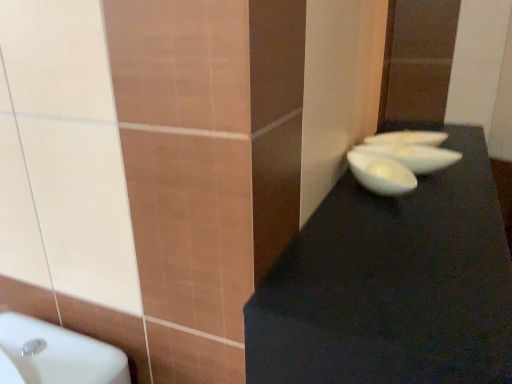
This screenshot has width=512, height=384. I want to click on white glossy bowl at center, the 2th basin in the back-to-front sequence, so click(x=413, y=156).

The height and width of the screenshot is (384, 512). Describe the element at coordinates (392, 284) in the screenshot. I see `black matte table at right` at that location.

Image resolution: width=512 pixels, height=384 pixels. Identify the location of white glossy bowl at upper right, positioned as the first basin in back-to-front order. (408, 138).

At what (x,y) coordinates should I click in order to perform the action: click on white glossy bowl at center, the first basin viewed from the front. Please return your answer as a coordinate pair (x, y). This screenshot has width=512, height=384. Looking at the image, I should click on (413, 156).

Is white glossy bowl at center, the first basin viewed from the front, directly adjacent to black matte table at right?

No, white glossy bowl at center, the first basin viewed from the front, is not making contact with black matte table at right.

From a real-world perspective, is white glossy bowl at center, the first basin viewed from the front, above or below black matte table at right?

white glossy bowl at center, the first basin viewed from the front, is above black matte table at right.

Considering the relative positions of white glossy bowl at center, the 2th basin in the back-to-front sequence, and black matte table at right in the image provided, is white glossy bowl at center, the 2th basin in the back-to-front sequence, to the left or to the right of black matte table at right?

From the image, it's evident that white glossy bowl at center, the 2th basin in the back-to-front sequence, is to the left of black matte table at right.

How distant is white glossy bowl at center, the first basin viewed from the front, from black matte table at right?

A distance of 13.53 inches exists between white glossy bowl at center, the first basin viewed from the front, and black matte table at right.

From a real-world perspective, is black matte table at right physically below white glossy bowl at center, the first basin viewed from the front?

Correct, in the physical world, black matte table at right is lower than white glossy bowl at center, the first basin viewed from the front.

From the picture: Does black matte table at right come behind white glossy bowl at center, the first basin viewed from the front?

No.

Is black matte table at right shorter than white glossy bowl at center, the first basin viewed from the front?

No.

Considering the sizes of objects white glossy bowl at center right and white glossy bowl at upper right, positioned as the first basin in back-to-front order, in the image provided, who is thinner, white glossy bowl at center right or white glossy bowl at upper right, positioned as the first basin in back-to-front order,?

Thinner between the two is white glossy bowl at center right.

From a real-world perspective, relative to white glossy bowl at upper right, positioned as the first basin in back-to-front order, is white glossy bowl at center right vertically above or below?

In terms of real-world spatial position, white glossy bowl at center right is below white glossy bowl at upper right, positioned as the first basin in back-to-front order.

Is point (391, 167) closer or farther from the camera than point (419, 131)?

Point (391, 167) is closer to the camera than point (419, 131).

Is white glossy bowl at center right far from white glossy bowl at upper right, positioned as the first basin in back-to-front order?

white glossy bowl at center right is actually quite close to white glossy bowl at upper right, positioned as the first basin in back-to-front order.

Measure the distance from black matte table at right to white glossy bowl at center right.

black matte table at right is 24.92 centimeters away from white glossy bowl at center right.

Is black matte table at right not within white glossy bowl at center right?

Yes.

Does point (449, 343) lie behind point (371, 189)?

No.

From the image's perspective, which is below, black matte table at right or white glossy bowl at center right?

black matte table at right, from the image's perspective.

Image resolution: width=512 pixels, height=384 pixels. In order to click on table top on the left side of white glossy bowl at upper right, the second basin in the front-to-back sequence in this screenshot , I will do `click(392, 284)`.

From the image's perspective, between white glossy bowl at upper right, positioned as the first basin in back-to-front order, and black matte table at right, who is located below?

black matte table at right appears lower in the image.

Which object is thinner, white glossy bowl at upper right, the second basin in the front-to-back sequence, or black matte table at right?

With smaller width is white glossy bowl at upper right, the second basin in the front-to-back sequence.

Considering the sizes of objects white glossy bowl at upper right, the second basin in the front-to-back sequence, and black matte table at right in the image provided, who is smaller, white glossy bowl at upper right, the second basin in the front-to-back sequence, or black matte table at right?

Smaller between the two is white glossy bowl at upper right, the second basin in the front-to-back sequence.

Which of these two, white glossy bowl at upper right, positioned as the first basin in back-to-front order, or white glossy bowl at center right, is wider?

With larger width is white glossy bowl at upper right, positioned as the first basin in back-to-front order.

Is white glossy bowl at upper right, the second basin in the front-to-back sequence, taller than white glossy bowl at center right?

No, white glossy bowl at upper right, the second basin in the front-to-back sequence, is not taller than white glossy bowl at center right.

Does white glossy bowl at upper right, positioned as the first basin in back-to-front order, appear on the right side of white glossy bowl at center right?

Yes, white glossy bowl at upper right, positioned as the first basin in back-to-front order, is to the right of white glossy bowl at center right.

In the scene shown: Are white glossy bowl at upper right, the second basin in the front-to-back sequence, and white glossy bowl at center right beside each other?

No.

Considering the positions of objects white glossy bowl at center, the first basin viewed from the front, and white glossy bowl at center right in the image provided, who is behind, white glossy bowl at center, the first basin viewed from the front, or white glossy bowl at center right?

white glossy bowl at center, the first basin viewed from the front, is further from the camera.

Is white glossy bowl at center, the 2th basin in the back-to-front sequence, surrounding white glossy bowl at center right?

That's incorrect, white glossy bowl at center right is not inside white glossy bowl at center, the 2th basin in the back-to-front sequence.

How different are the orientations of white glossy bowl at center, the 2th basin in the back-to-front sequence, and white glossy bowl at center right in degrees?

54.1 degrees separate the facing orientations of white glossy bowl at center, the 2th basin in the back-to-front sequence, and white glossy bowl at center right.

Considering the positions of point (459, 157) and point (371, 180), is point (459, 157) closer or farther from the camera than point (371, 180)?

Clearly, point (459, 157) is more distant from the camera than point (371, 180).

The image size is (512, 384). Find the location of `table top located underneath the white glossy bowl at center, the first basin viewed from the front (from a real-world perspective)`. table top located underneath the white glossy bowl at center, the first basin viewed from the front (from a real-world perspective) is located at coordinates (392, 284).

Identify the location of table top on the right of white glossy bowl at center, the 2th basin in the back-to-front sequence. (392, 284).

Estimate the real-world distances between objects in this image. Which object is further from white glossy bowl at center right, white glossy bowl at center, the 2th basin in the back-to-front sequence, or white glossy bowl at upper right, positioned as the first basin in back-to-front order?

white glossy bowl at upper right, positioned as the first basin in back-to-front order, lies further to white glossy bowl at center right than the other object.

From the image, which object appears to be nearer to white glossy bowl at upper right, positioned as the first basin in back-to-front order, black matte table at right or white glossy bowl at center, the 2th basin in the back-to-front sequence?

white glossy bowl at center, the 2th basin in the back-to-front sequence, is positioned closer to the anchor white glossy bowl at upper right, positioned as the first basin in back-to-front order.

When comparing their distances from black matte table at right, does white glossy bowl at center right or white glossy bowl at center, the 2th basin in the back-to-front sequence, seem closer?

white glossy bowl at center right is closer to black matte table at right.

When comparing their distances from white glossy bowl at upper right, the second basin in the front-to-back sequence, does black matte table at right or white glossy bowl at center right seem closer?

Based on the image, white glossy bowl at center right appears to be nearer to white glossy bowl at upper right, the second basin in the front-to-back sequence.

When comparing their distances from white glossy bowl at center right, does white glossy bowl at upper right, the second basin in the front-to-back sequence, or white glossy bowl at center, the 2th basin in the back-to-front sequence, seem further?

Based on the image, white glossy bowl at upper right, the second basin in the front-to-back sequence, appears to be further to white glossy bowl at center right.

Based on their spatial positions, is black matte table at right or white glossy bowl at upper right, positioned as the first basin in back-to-front order, closer to white glossy bowl at center right?

black matte table at right is closer to white glossy bowl at center right.

Considering their positions, is white glossy bowl at center right positioned closer to white glossy bowl at center, the first basin viewed from the front, than white glossy bowl at upper right, the second basin in the front-to-back sequence?

The object closer to white glossy bowl at center, the first basin viewed from the front, is white glossy bowl at upper right, the second basin in the front-to-back sequence.

When comparing their distances from black matte table at right, does white glossy bowl at center, the first basin viewed from the front, or white glossy bowl at upper right, the second basin in the front-to-back sequence, seem closer?

white glossy bowl at center, the first basin viewed from the front.

The image size is (512, 384). I want to click on basin positioned between white glossy bowl at center right and white glossy bowl at upper right, positioned as the first basin in back-to-front order, from near to far, so click(413, 156).

You are a GUI agent. You are given a task and a screenshot of the screen. Output one action in this format:
    pyautogui.click(x=<x>, y=<y>)
    Task: Click on the basin between black matte table at right and white glossy bowl at upper right, positioned as the first basin in back-to-front order, in the front-back direction
    Image resolution: width=512 pixels, height=384 pixels.
    Given the screenshot: What is the action you would take?
    pyautogui.click(x=413, y=156)

Locate an element on the screen. The height and width of the screenshot is (384, 512). glass bowl between black matte table at right and white glossy bowl at center, the 2th basin in the back-to-front sequence, along the z-axis is located at coordinates (381, 174).

The height and width of the screenshot is (384, 512). In order to click on glass bowl positioned between black matte table at right and white glossy bowl at upper right, positioned as the first basin in back-to-front order, from near to far in this screenshot , I will do `click(381, 174)`.